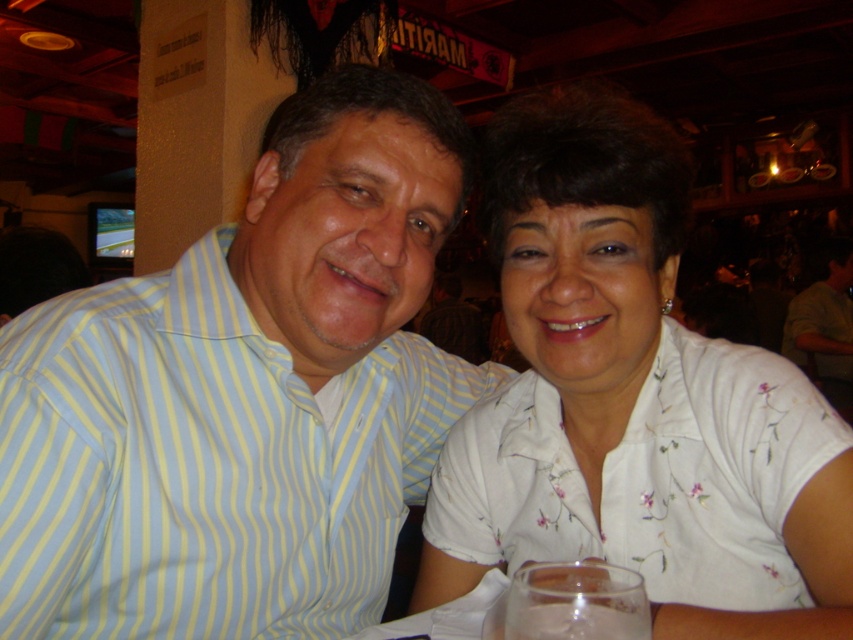
Can you confirm if light blue striped shirt at center is positioned above white floral shirt at center?

Actually, light blue striped shirt at center is below white floral shirt at center.

Can you confirm if light blue striped shirt at center is thinner than white floral shirt at center?

Incorrect, light blue striped shirt at center's width is not less than white floral shirt at center's.

Is point (154, 529) closer to viewer compared to point (665, 340)?

Yes.

This screenshot has height=640, width=853. In order to click on light blue striped shirt at center in this screenshot , I will do click(244, 396).